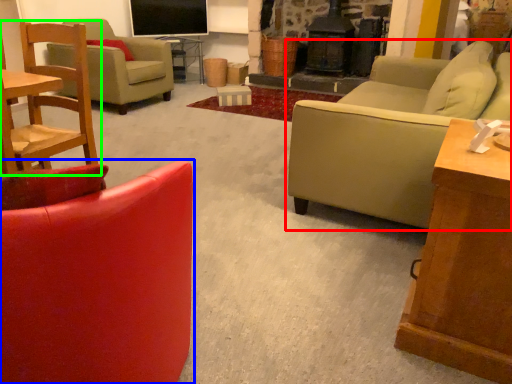
Question: Considering the real-world distances, which object is farthest from studio couch (highlighted by a red box)? chair (highlighted by a blue box) or chair (highlighted by a green box)?

Choices:
 (A) chair
 (B) chair

Answer: (B)